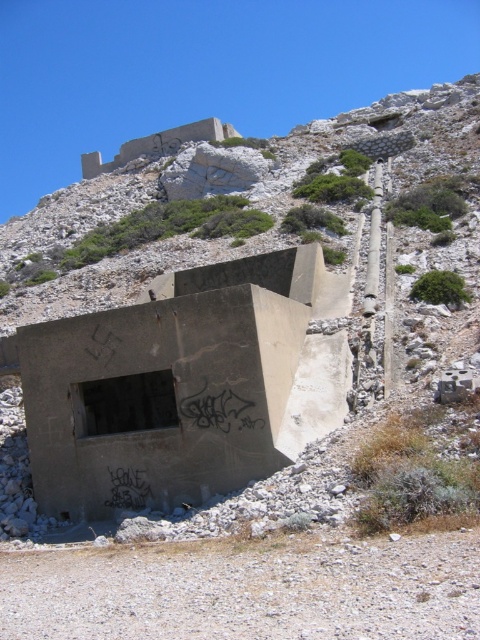
You are a surveyor using a coordinate system where the bottom left corner of the image is the origin point. You need to locate the concrete bunker at center. What are its coordinates?

The concrete bunker at center is located at coordinates point (248, 317).